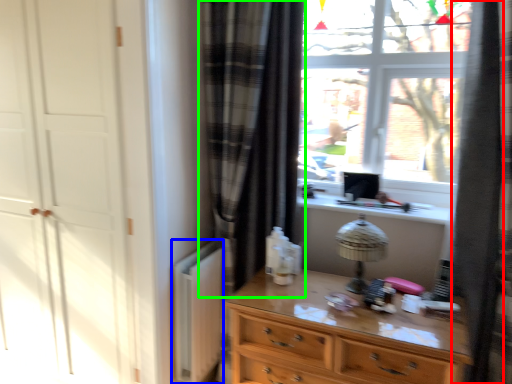
Question: Considering the real-world distances, which object is closest to shower curtain (highlighted by a red box)? radiator (highlighted by a blue box) or curtain (highlighted by a green box).

Choices:
 (A) radiator
 (B) curtain

Answer: (B)